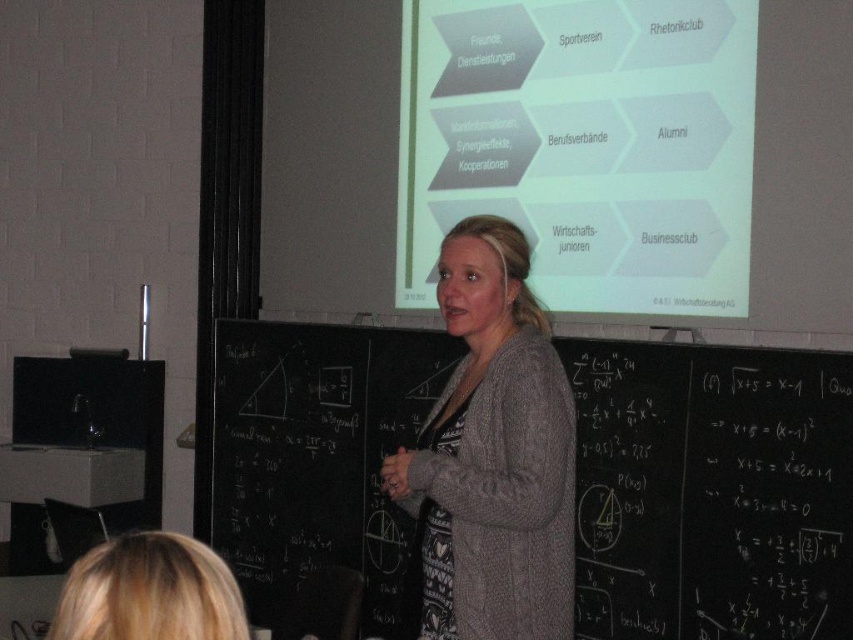
Question: Can you confirm if green matte projector screen at upper center is thinner than blonde hair at lower left?

Choices:
 (A) no
 (B) yes

Answer: (A)

Question: Which object appears closest to the camera in this image?

Choices:
 (A) blonde hair at lower left
 (B) green matte projector screen at upper center
 (C) knitted gray cardigan at center

Answer: (A)

Question: Can you confirm if knitted gray cardigan at center is bigger than blonde hair at lower left?

Choices:
 (A) no
 (B) yes

Answer: (B)

Question: Which point is farther from the camera taking this photo?

Choices:
 (A) (291, 500)
 (B) (103, 544)
 (C) (422, 246)

Answer: (A)

Question: Which point is closer to the camera?

Choices:
 (A) blonde hair at lower left
 (B) knitted gray cardigan at center
 (C) green matte projector screen at upper center

Answer: (A)

Question: Does green matte projector screen at upper center lie behind knitted gray cardigan at center?

Choices:
 (A) yes
 (B) no

Answer: (A)